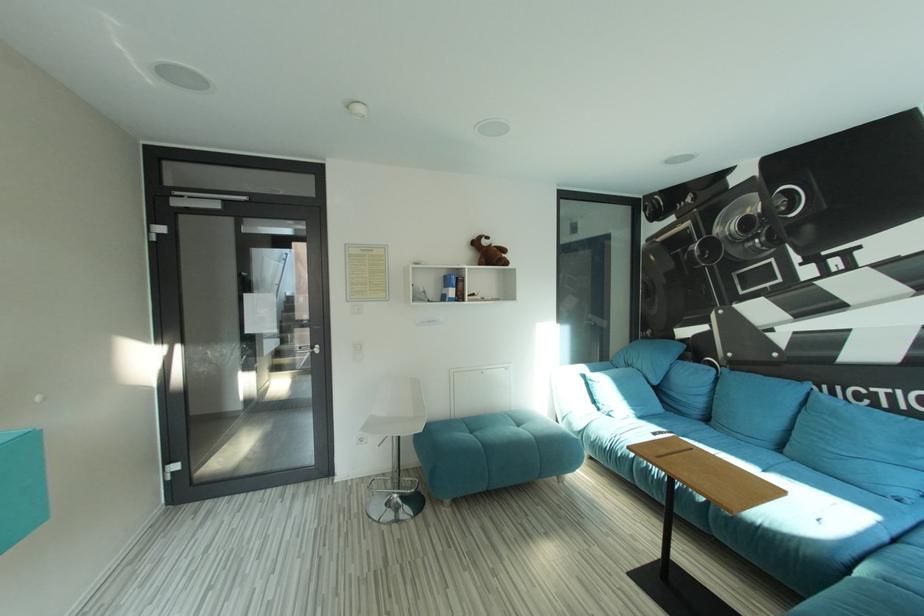
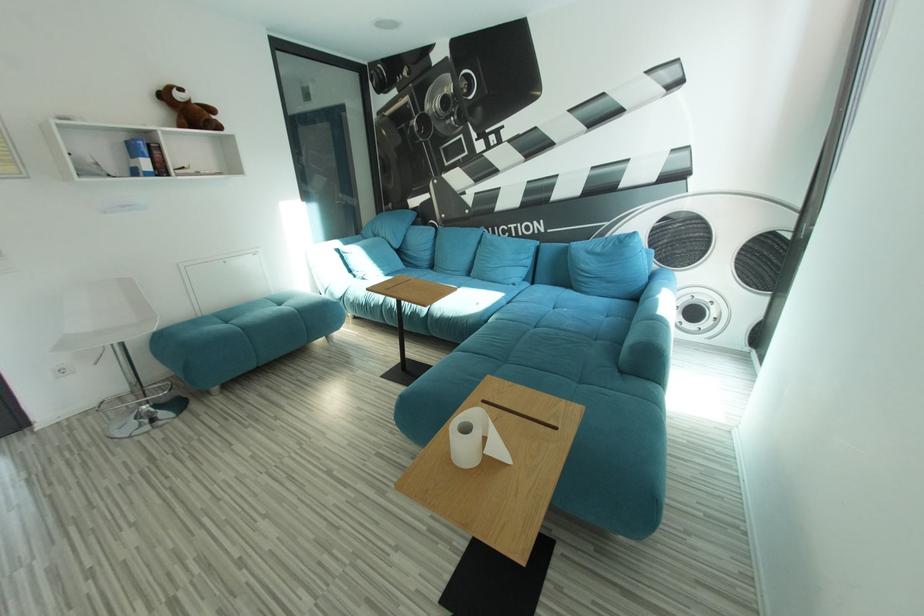
The images are taken continuously from a first-person perspective. In which direction is your viewpoint rotating?

The camera rotated toward right-down.